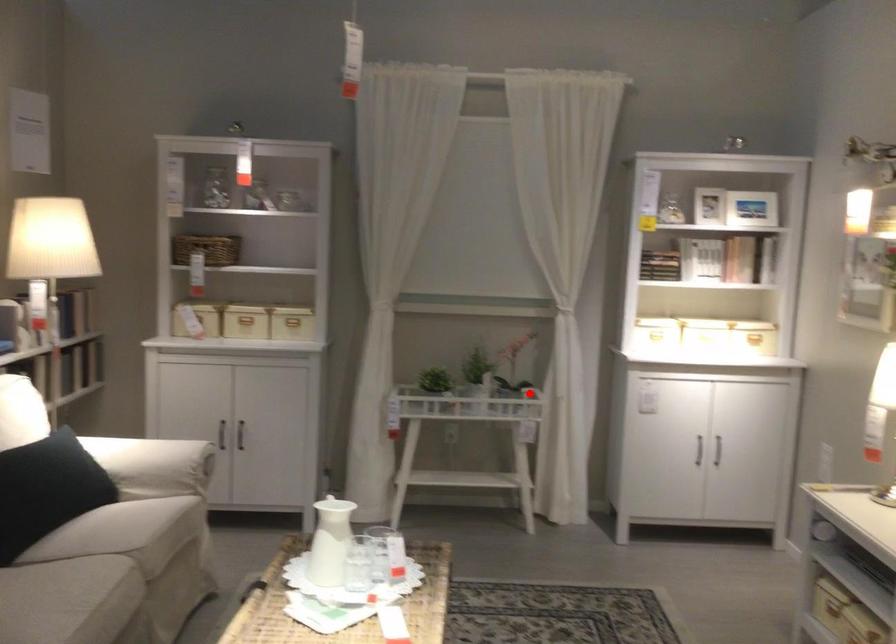
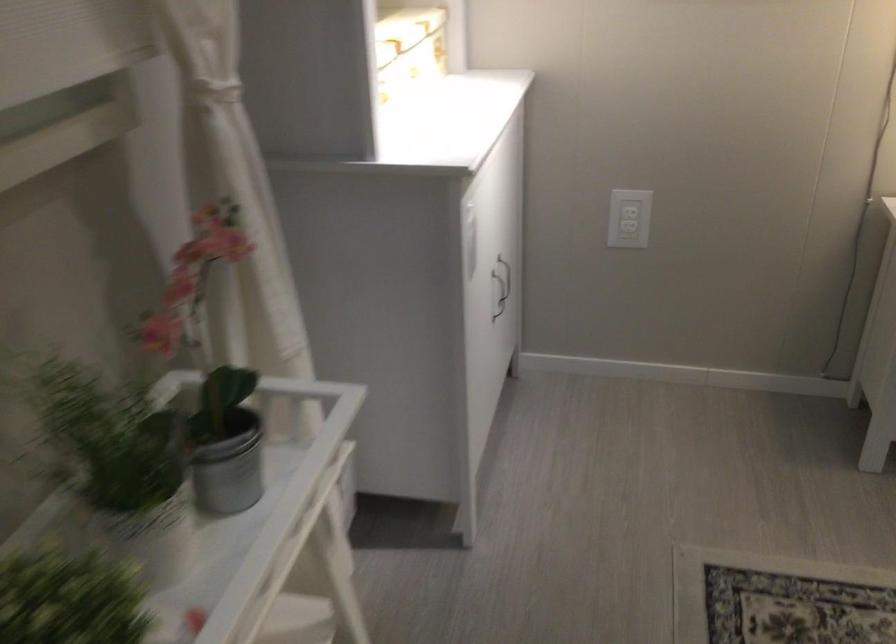
Locate, in the second image, the point that corresponds to the highlighted location in the first image.

(227, 462)